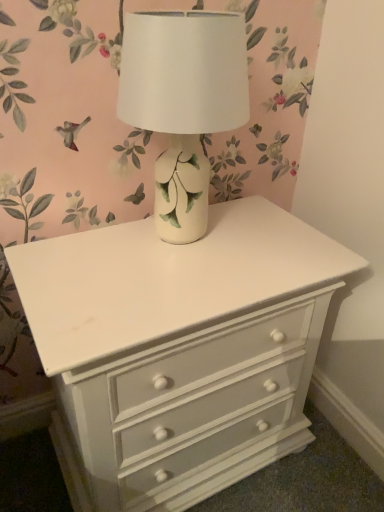
Where is `free spot to the left of white ceramic table lamp at center`? This screenshot has height=512, width=384. free spot to the left of white ceramic table lamp at center is located at coordinates (74, 253).